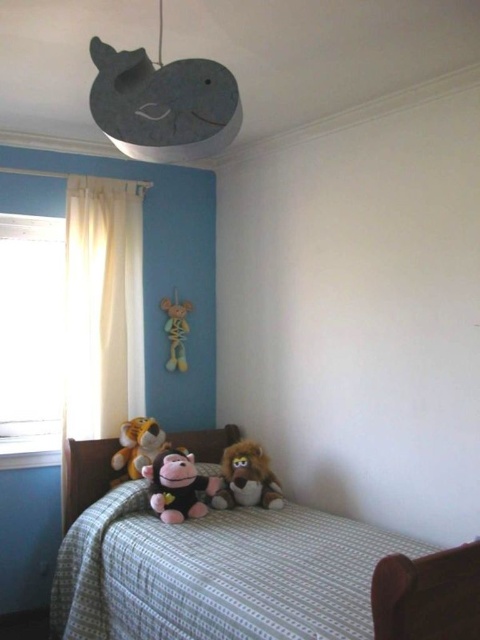
You are a parent trying to hang a new picture on the wall. You want to ensure it won t block the view of the transparent glass window at left from the checkered fabric bed at lower center. Where should you place the picture?

You should place the picture behind the checkered fabric bed at lower center so it doesn t block the view of the transparent glass window at left, since the bed is in front of the window.

You are a parent trying to find a toy for your child. You see the checkered fabric bed at lower center and the yellow fabric skeleton at center. Which object is closer to the ground?

The checkered fabric bed at lower center is located below the yellow fabric skeleton at center, so it is closer to the ground.

Based on the photo, you need to decide whether a large blanket that is 2 meters wide will fit on the checkered fabric bed at lower center. The transparent glass window at left is 1.5 meters wide. Can you determine if the blanket will fit?

The checkered fabric bed at lower center is wider than the transparent glass window at left, which is 1.5 meters wide. Since the bed is wider, the 2 meter wide blanket will fit on the checkered fabric bed at lower center.